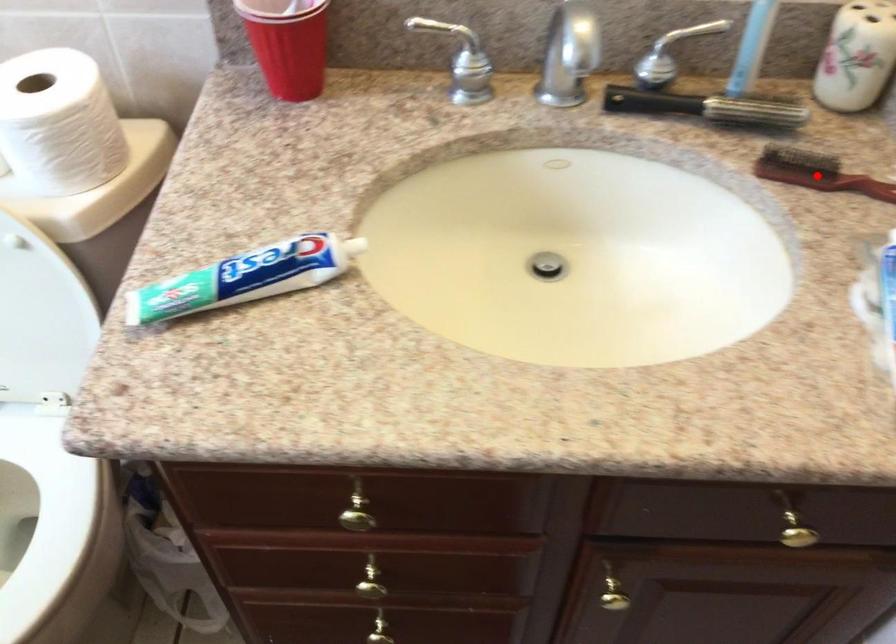
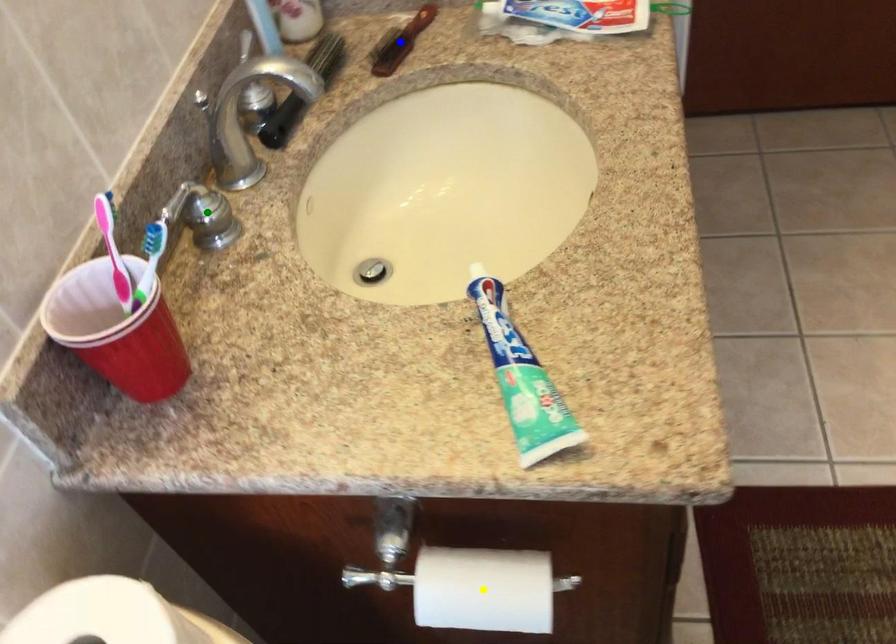
Question: I am providing you with two images of the same scene from different viewpoints. A red point is marked on the first image. You are given multiple points on the second image. Which mark in image 2 goes with the point in image 1?

Choices:
 (A) green point
 (B) yellow point
 (C) blue point

Answer: (C)